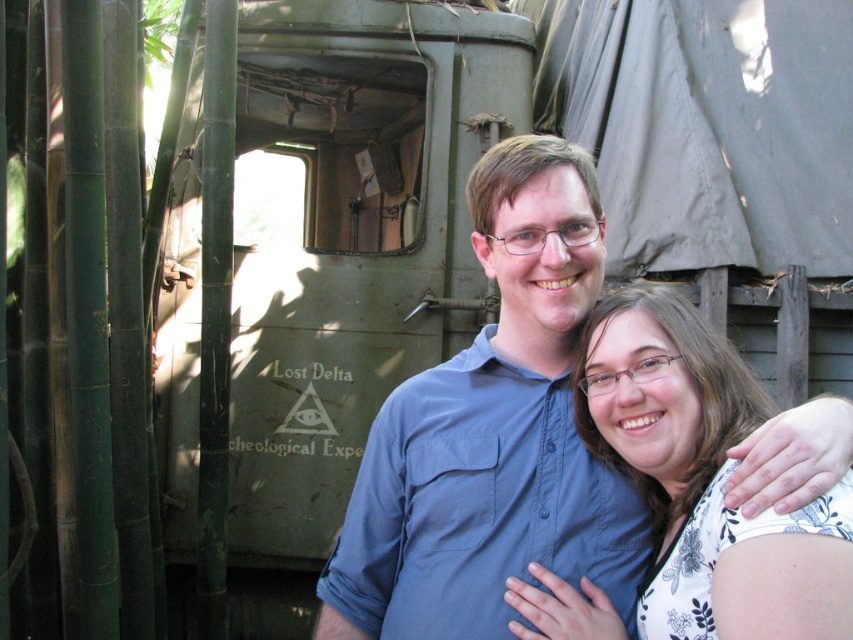
You are a photographer trying to capture a clear shot of both the blue cotton shirt at center and the white floral blouse at center. Based on their positions, which one might be partially obscured in the photo?

The white floral blouse at center is behind the blue cotton shirt at center, so it might be partially obscured in the photo.

You are a photographer trying to capture a group photo of the blue cotton shirt at center and the white floral blouse at center. Since you want to ensure both are visible, which one should you place on the left side of the frame to match their current positions?

The blue cotton shirt at center is positioned on the left side of white floral blouse at center, so to match their current positions, you should place the blue cotton shirt at center on the left side of the frame.

You are a photographer trying to capture a closeup of both the blue cotton shirt at center and the white floral blouse at center in the scene. Given that your camera has a maximum focus range of 8 inches, will you be able to capture both shirts in focus at the same time?

The blue cotton shirt at center and white floral blouse at center are 8.29 inches apart from each other. Since the distance between them exceeds the camera focus range of 8 inches, you cannot capture both shirts in focus simultaneously.